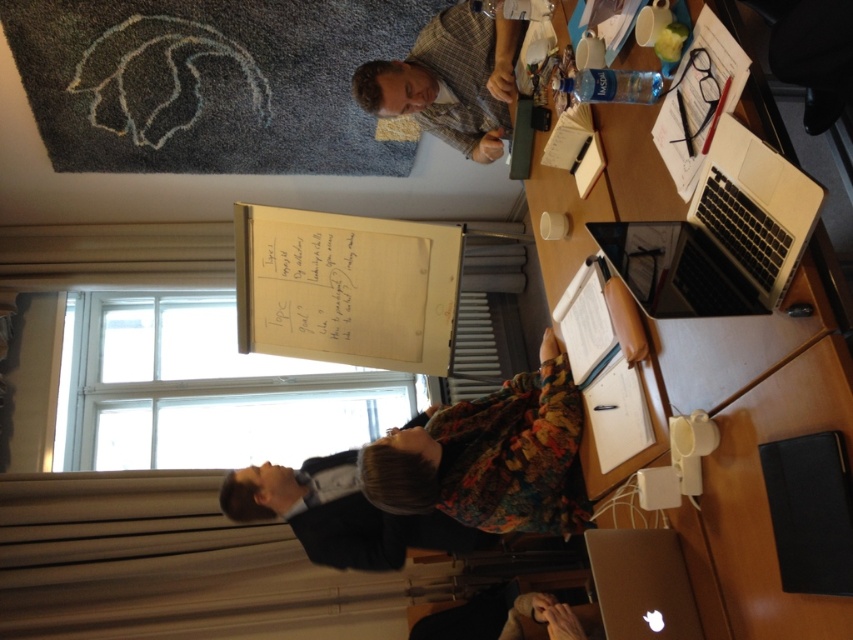
You are standing in front of the table in the meeting room. There are two points marked on the table surface. One is at coordinate point (486, 406) and the other is at point (473, 108). Which of these two points is closer to your viewpoint?

Point (486, 406) is closer to the camera than point (473, 108).

You are organizing a presentation and need to place a 1.5 meter tall easel with a whiteboard on it in this room. Considering the white paperboard at center and the plaid fabric shirt at upper center, which object is taller and can accommodate the easel?

The white paperboard at center is taller than the plaid fabric shirt at upper center. Since the easel is 1.5 meters tall, the white paperboard at center can accommodate the easel as it has a greater height.